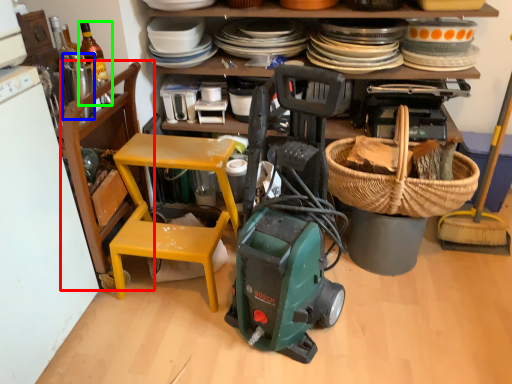
Question: Based on their relative distances, which object is nearer to chair (highlighted by a red box)? Choose from appliance (highlighted by a blue box) and bottle (highlighted by a green box).

Choices:
 (A) appliance
 (B) bottle

Answer: (B)